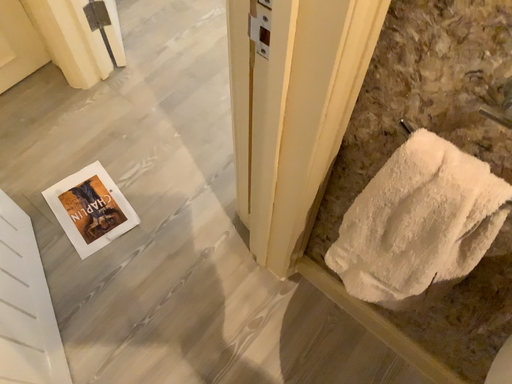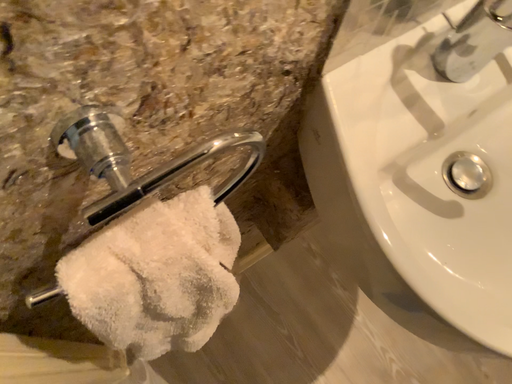
Question: Which way did the camera rotate in the video?

Choices:
 (A) rotated right
 (B) rotated left

Answer: (A)